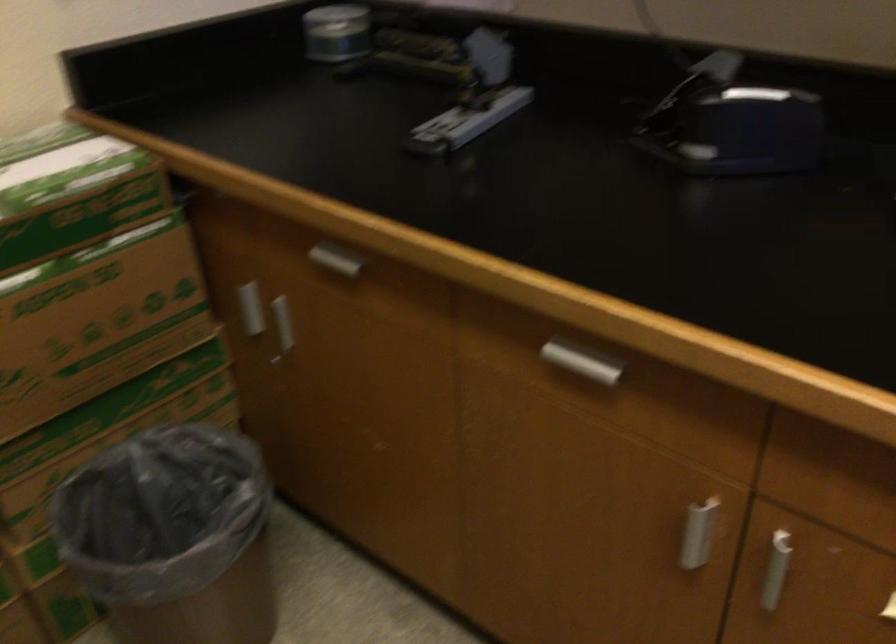
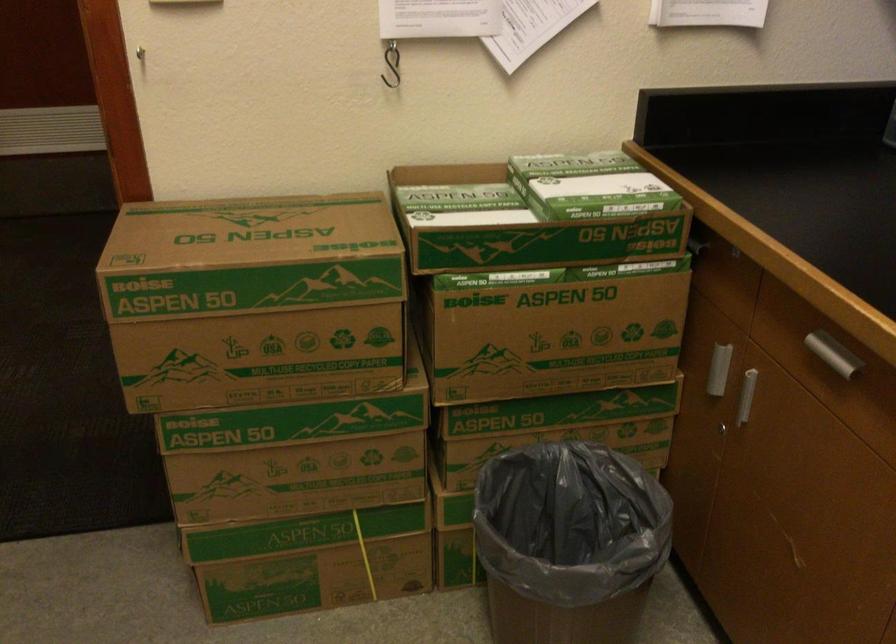
The point at [183,525] is marked in the first image. Where is the corresponding point in the second image?

(569, 543)